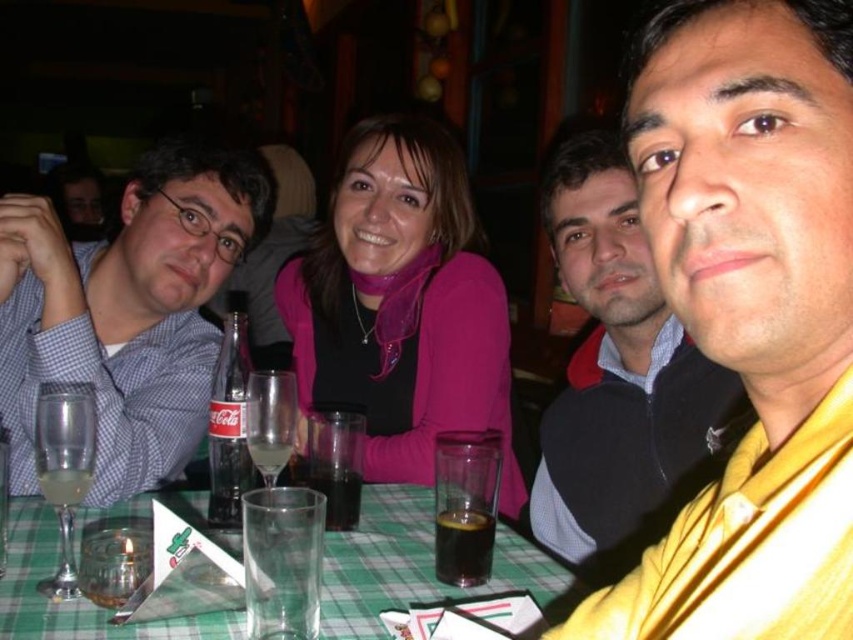
You are a waiter at a restaurant and need to place a new drink order on the table. The table has a green checkered tablecloth at lower center and a clear glass wine glass at lower left. Where should you place the new drink to avoid knocking over the existing glass?

Place the new drink on the green checkered tablecloth at lower center since it is to the right of the clear glass wine glass at lower left, providing a safer distance from the existing glass.

You are standing in front of the table in the image. What are the coordinates of the green checkered tablecloth at lower center?

The coordinates of the green checkered tablecloth at lower center are at point (412, 564).